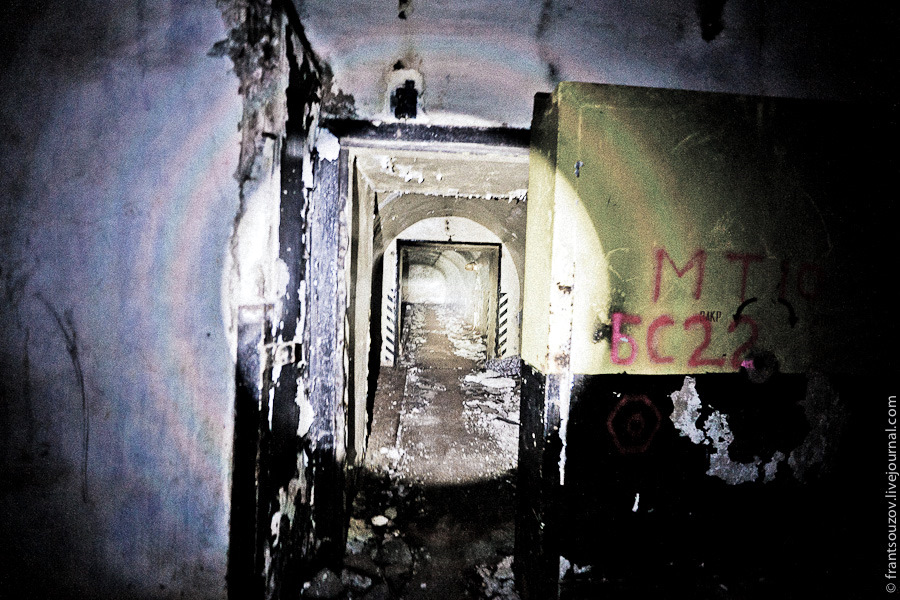
Locate an element on the screen. This screenshot has width=900, height=600. golden and black door is located at coordinates (633, 165), (594, 475).